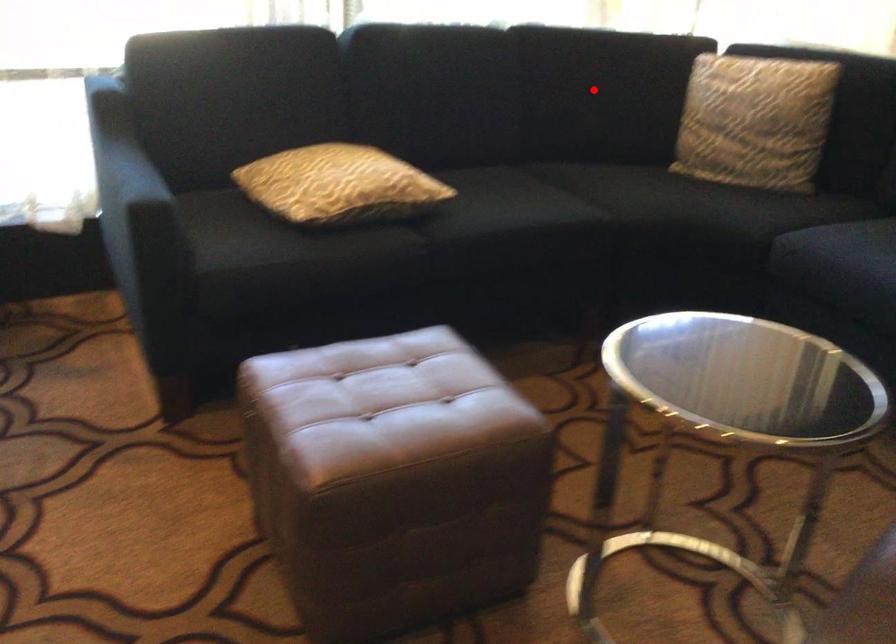
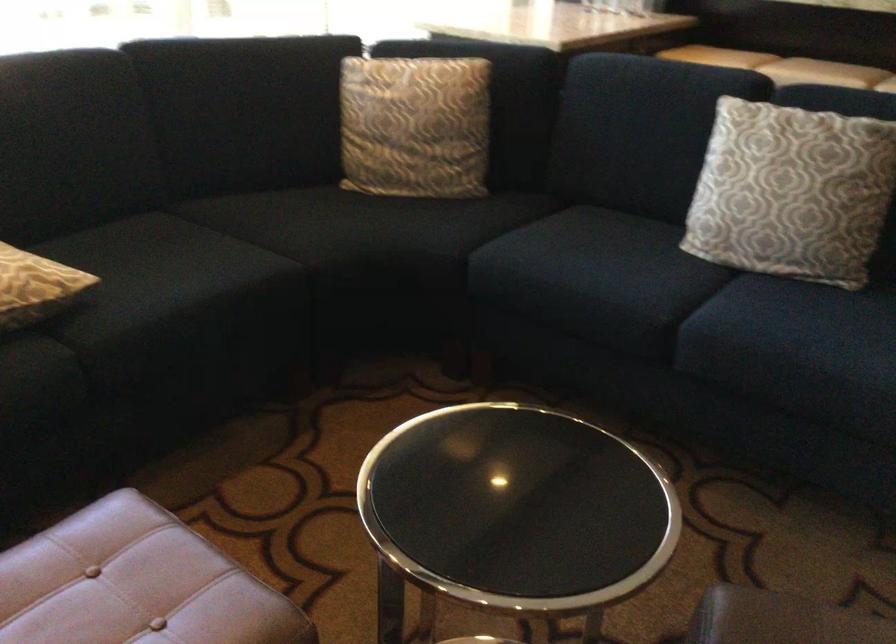
Question: A red point is marked in image1. In image2, is the corresponding 3D point closer to the camera or farther? Reply with the corresponding letter.

Choices:
 (A) The corresponding 3D point is closer.
 (B) The corresponding 3D point is farther.

Answer: (A)